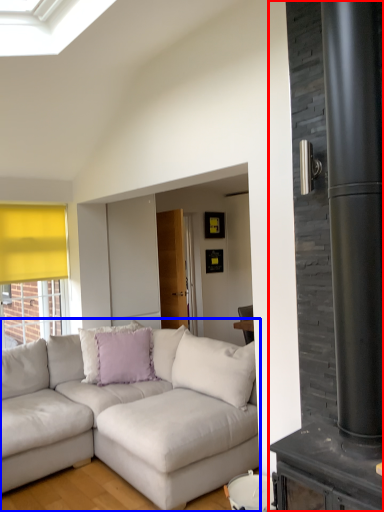
Question: Which point is further to the camera, fireplace (highlighted by a red box) or studio couch (highlighted by a blue box)?

Choices:
 (A) fireplace
 (B) studio couch

Answer: (B)